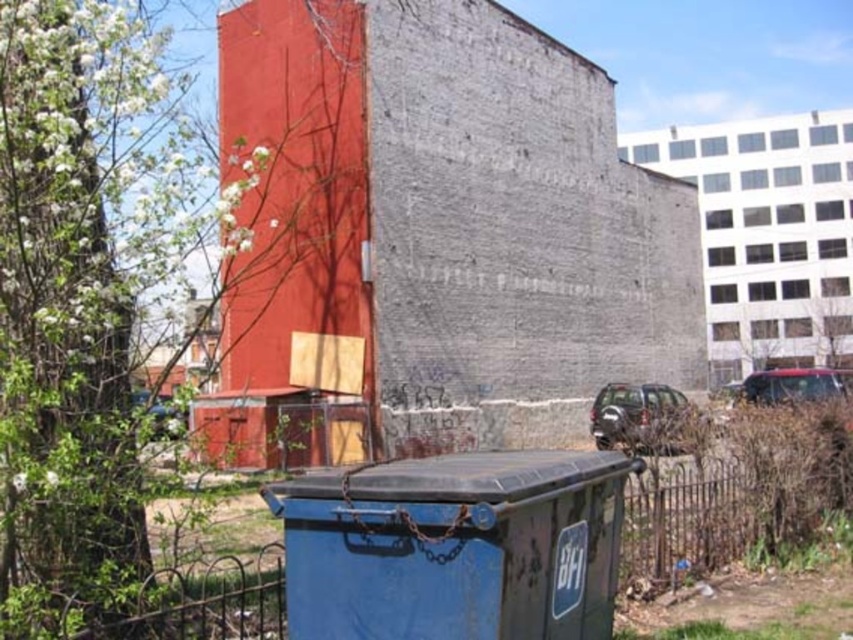
Question: Which point is closer to the camera taking this photo?

Choices:
 (A) (309, 582)
 (B) (39, 502)
 (C) (844, 280)
 (D) (776, 352)

Answer: (A)

Question: Which point is farther to the camera?

Choices:
 (A) green leafy tree at upper center
 (B) green leafy tree at left

Answer: (A)

Question: Where is green leafy tree at left located in relation to green leafy tree at upper center in the image?

Choices:
 (A) left
 (B) right

Answer: (A)

Question: Which point is farther to the camera?

Choices:
 (A) (3, 284)
 (B) (827, 314)

Answer: (B)

Question: Does green leafy tree at upper right appear on the right side of green leafy tree at upper center?

Choices:
 (A) yes
 (B) no

Answer: (A)

Question: Does green leafy tree at left have a smaller size compared to green leafy tree at upper right?

Choices:
 (A) yes
 (B) no

Answer: (B)